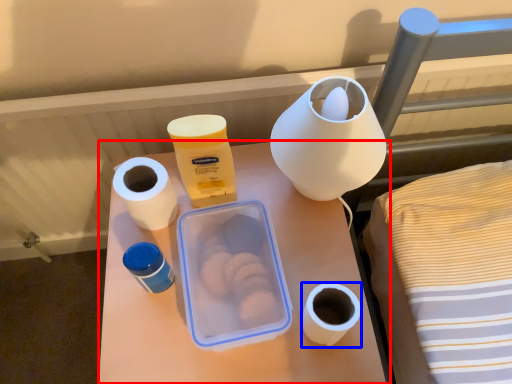
Question: Which object appears closest to the camera in this image, table (highlighted by a red box) or toilet paper (highlighted by a blue box)?

Choices:
 (A) table
 (B) toilet paper

Answer: (B)